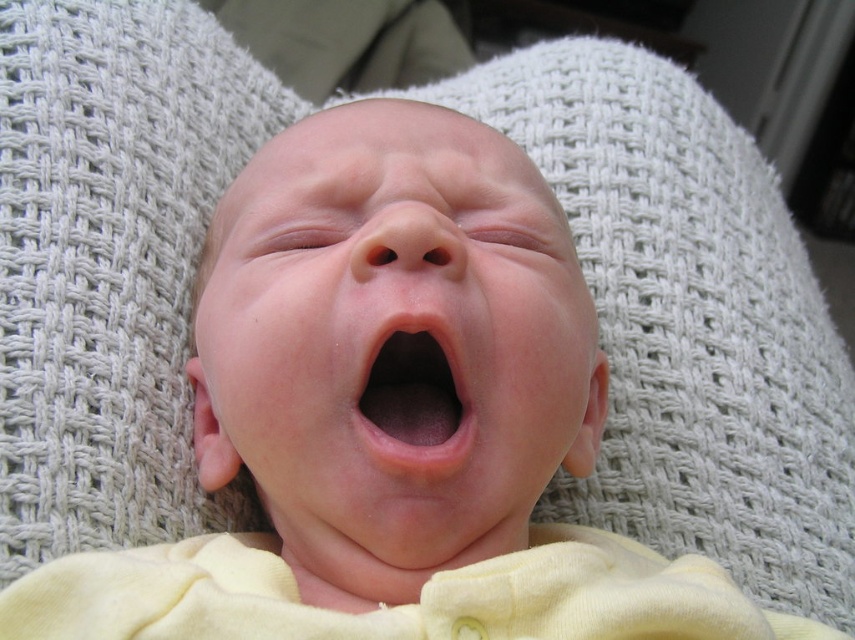
Question: Which of the following is the farthest from the observer?

Choices:
 (A) pink smooth flesh at center
 (B) smooth skin face at center

Answer: (A)

Question: From the image, what is the correct spatial relationship of smooth skin face at center in relation to pink smooth flesh at center?

Choices:
 (A) above
 (B) below

Answer: (A)

Question: Can you confirm if smooth skin face at center is thinner than pink smooth flesh at center?

Choices:
 (A) no
 (B) yes

Answer: (A)

Question: Which object appears closest to the camera in this image?

Choices:
 (A) pink smooth flesh at center
 (B) smooth skin face at center

Answer: (B)

Question: Observing the image, what is the correct spatial positioning of smooth skin face at center in reference to pink smooth flesh at center?

Choices:
 (A) above
 (B) below

Answer: (A)